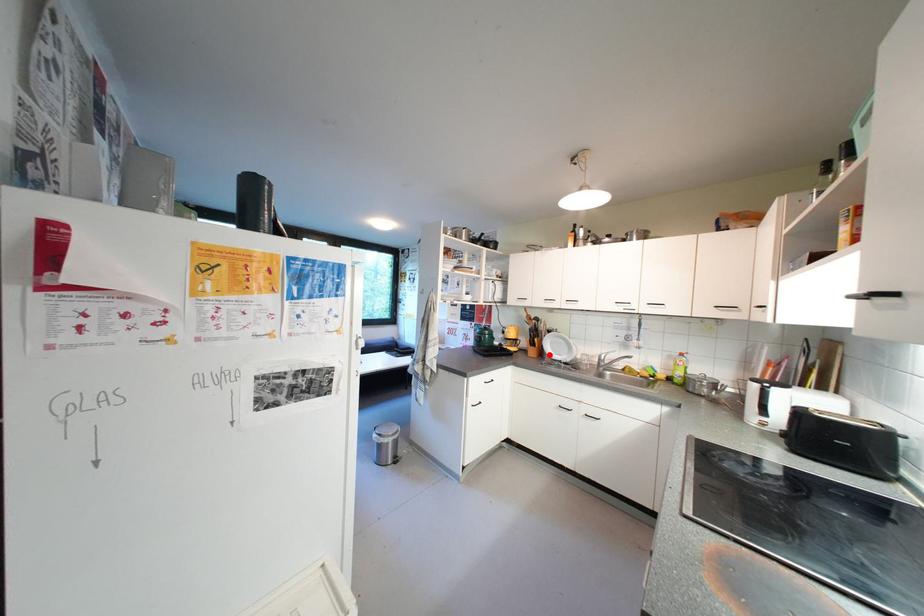
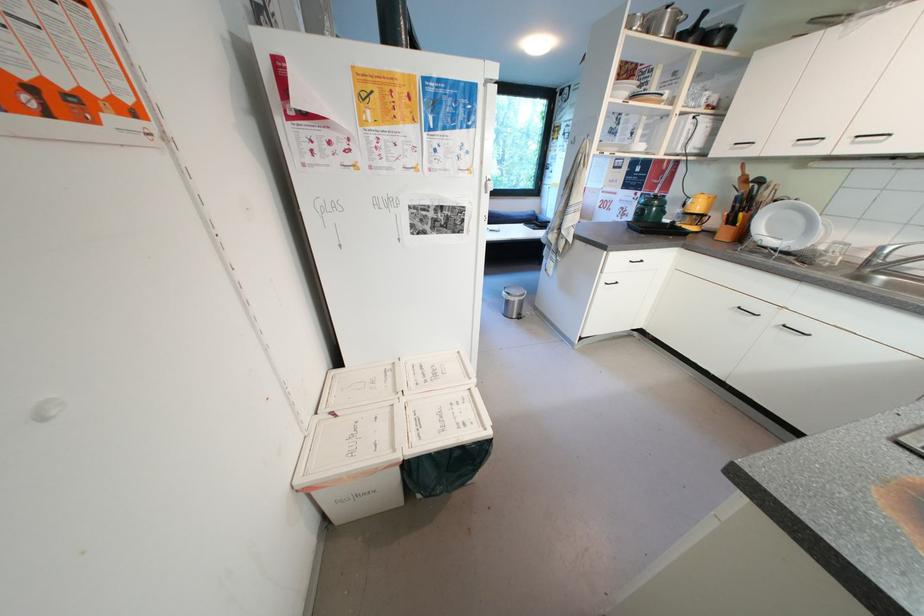
Locate, in the second image, the point that corresponds to the highlighted location in the first image.

(749, 238)